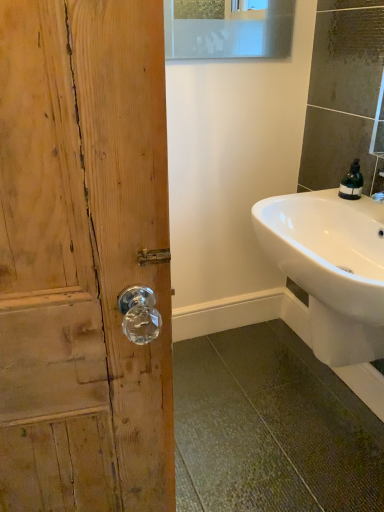
Question: Should I look upward or downward to see white glossy sink at lower right?

Choices:
 (A) down
 (B) up

Answer: (A)

Question: Would you consider green matte soap dispenser at upper right to be distant from white glossy sink at lower right?

Choices:
 (A) no
 (B) yes

Answer: (A)

Question: Does green matte soap dispenser at upper right have a greater width compared to white glossy sink at lower right?

Choices:
 (A) yes
 (B) no

Answer: (B)

Question: Is white glossy sink at lower right at the back of green matte soap dispenser at upper right?

Choices:
 (A) yes
 (B) no

Answer: (B)

Question: Is green matte soap dispenser at upper right in contact with white glossy sink at lower right?

Choices:
 (A) no
 (B) yes

Answer: (A)

Question: Considering the relative sizes of green matte soap dispenser at upper right and white glossy sink at lower right in the image provided, is green matte soap dispenser at upper right bigger than white glossy sink at lower right?

Choices:
 (A) yes
 (B) no

Answer: (B)

Question: Is green matte soap dispenser at upper right positioned behind white glossy sink at lower right?

Choices:
 (A) yes
 (B) no

Answer: (A)

Question: Is white glossy sink at lower right wider than green matte soap dispenser at upper right?

Choices:
 (A) no
 (B) yes

Answer: (B)

Question: From a real-world perspective, is white glossy sink at lower right over green matte soap dispenser at upper right?

Choices:
 (A) no
 (B) yes

Answer: (A)

Question: From a real-world perspective, is white glossy sink at lower right physically below green matte soap dispenser at upper right?

Choices:
 (A) no
 (B) yes

Answer: (B)

Question: Could green matte soap dispenser at upper right be considered to be inside white glossy sink at lower right?

Choices:
 (A) yes
 (B) no

Answer: (B)

Question: Considering the relative sizes of white glossy sink at lower right and green matte soap dispenser at upper right in the image provided, is white glossy sink at lower right shorter than green matte soap dispenser at upper right?

Choices:
 (A) no
 (B) yes

Answer: (A)

Question: Is there a large distance between white glossy sink at lower right and green matte soap dispenser at upper right?

Choices:
 (A) yes
 (B) no

Answer: (B)

Question: Does point (357, 169) appear closer or farther from the camera than point (331, 198)?

Choices:
 (A) farther
 (B) closer

Answer: (B)